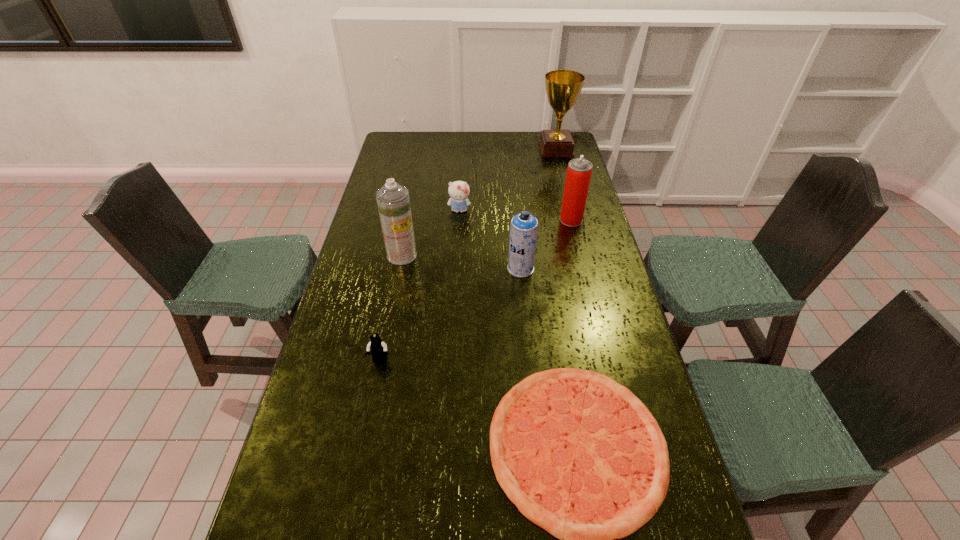
The width and height of the screenshot is (960, 540). Identify the location of vacant area located 0.370m on the plaque of the award. (463, 149).

You are a GUI agent. You are given a task and a screenshot of the screen. Output one action in this format:
    pyautogui.click(x=<x>, y=<y>)
    Task: Click on the blank area located 0.150m on the plaque of the award
    The height and width of the screenshot is (540, 960).
    Given the screenshot: What is the action you would take?
    pyautogui.click(x=508, y=149)

Where is `vacant position located 0.060m on the back of the leftmost aerosol can`? vacant position located 0.060m on the back of the leftmost aerosol can is located at coordinates (406, 235).

I want to click on vacant space situated 0.100m on the back of the farthest aerosol can, so click(x=566, y=199).

Locate an element on the screen. This screenshot has height=540, width=960. free space located on the left of the shortest aerosol can is located at coordinates (430, 268).

Find the location of a particular element. This screenshot has height=540, width=960. free space located 0.340m on the front-facing side of the third shortest object is located at coordinates (456, 275).

What are the coordinates of `vacant space situated on the front-facing side of the second shortest object` in the screenshot? It's located at (348, 517).

Identify the location of object that is at the far edge. (563, 87).

Where is `aerosol can that is at the left edge`? aerosol can that is at the left edge is located at coordinates (393, 201).

Locate an element on the screen. The image size is (960, 540). Lego present at the left edge is located at coordinates (378, 349).